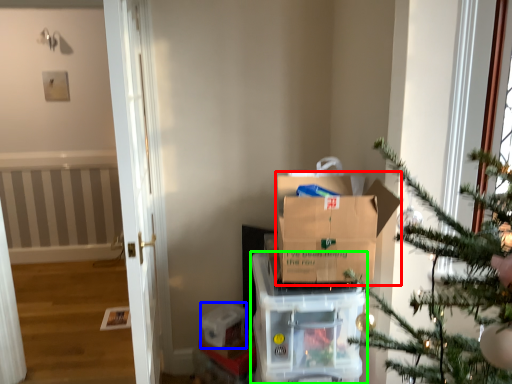
Question: Which is farther away from cardboard box (highlighted by a red box)? storage box (highlighted by a blue box) or appliance (highlighted by a green box)?

Choices:
 (A) storage box
 (B) appliance

Answer: (A)